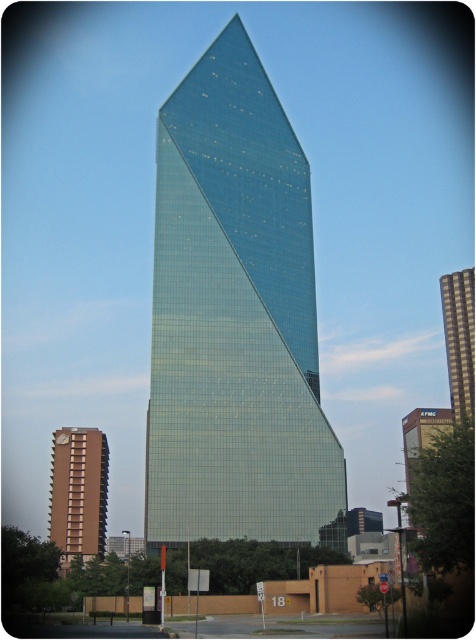
You are standing in front of the skyscraper and want to determine the relative positions of two points marked on the building. The first point is at coordinates point (88,499) and the second is at point (456,308). Which point is closer to you?

Point (88,499) is closer to the viewer than point (456,308).

In the scene shown: You are a city planner reviewing architectural blueprints. You notice two skyscrapers in the design plan labeled as the glassy teal skyscraper at center and the green glass skyscraper at center. According to the blueprint details, which one is taller?

The glassy teal skyscraper at center is taller than the green glass skyscraper at center based on the provided blueprint details.